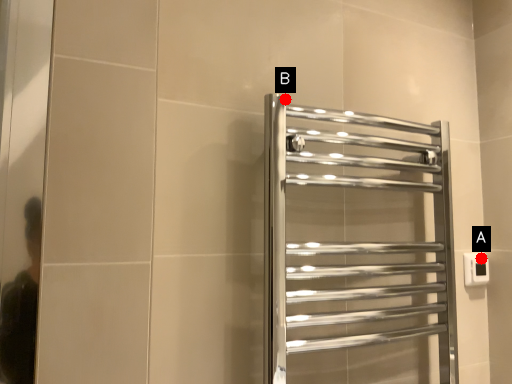
Question: Two points are circled on the image, labeled by A and B beside each circle. Which point appears farthest from the camera in this image?

Choices:
 (A) A is further
 (B) B is further

Answer: (A)